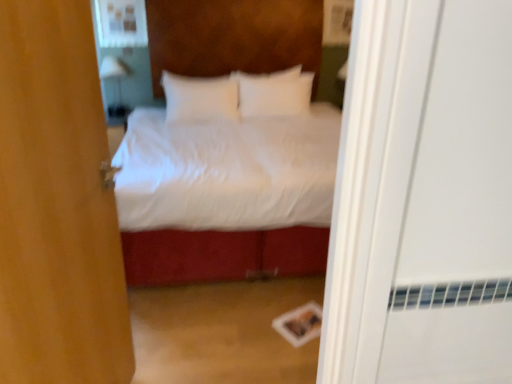
Question: From a real-world perspective, is brown fabric door at center over matte white medicine cabinet at upper left?

Choices:
 (A) yes
 (B) no

Answer: (B)

Question: Is brown fabric door at center positioned beyond the bounds of matte white medicine cabinet at upper left?

Choices:
 (A) no
 (B) yes

Answer: (B)

Question: From the image's perspective, is brown fabric door at center above matte white medicine cabinet at upper left?

Choices:
 (A) yes
 (B) no

Answer: (B)

Question: Would you say brown fabric door at center is a long distance from matte white medicine cabinet at upper left?

Choices:
 (A) no
 (B) yes

Answer: (B)

Question: From the image's perspective, is brown fabric door at center located beneath matte white medicine cabinet at upper left?

Choices:
 (A) no
 (B) yes

Answer: (B)

Question: From a real-world perspective, relative to white glossy lamp at upper left, is white soft pillow at center, the first pillow viewed from the right, vertically above or below?

Choices:
 (A) above
 (B) below

Answer: (A)

Question: Considering the positions of point (287, 112) and point (115, 56), is point (287, 112) closer or farther from the camera than point (115, 56)?

Choices:
 (A) farther
 (B) closer

Answer: (B)

Question: Looking at the image, does white soft pillow at center, positioned as the second pillow in left-to-right order, seem bigger or smaller compared to white glossy lamp at upper left?

Choices:
 (A) small
 (B) big

Answer: (B)

Question: From their relative heights in the image, would you say white soft pillow at center, positioned as the second pillow in left-to-right order, is taller or shorter than white glossy lamp at upper left?

Choices:
 (A) tall
 (B) short

Answer: (A)

Question: Is point (124, 8) closer or farther from the camera than point (278, 97)?

Choices:
 (A) closer
 (B) farther

Answer: (B)

Question: From their relative heights in the image, would you say matte white medicine cabinet at upper left is taller or shorter than white soft pillow at center, positioned as the second pillow in left-to-right order?

Choices:
 (A) tall
 (B) short

Answer: (B)

Question: In the image, is matte white medicine cabinet at upper left positioned in front of or behind white soft pillow at center, the first pillow viewed from the right?

Choices:
 (A) behind
 (B) front

Answer: (A)

Question: From the image's perspective, is matte white medicine cabinet at upper left located above or below white soft pillow at center, positioned as the second pillow in left-to-right order?

Choices:
 (A) above
 (B) below

Answer: (A)

Question: Is white glossy lamp at upper left taller or shorter than matte white medicine cabinet at upper left?

Choices:
 (A) short
 (B) tall

Answer: (B)

Question: Is point pyautogui.click(x=110, y=61) closer or farther from the camera than point pyautogui.click(x=103, y=16)?

Choices:
 (A) closer
 (B) farther

Answer: (B)